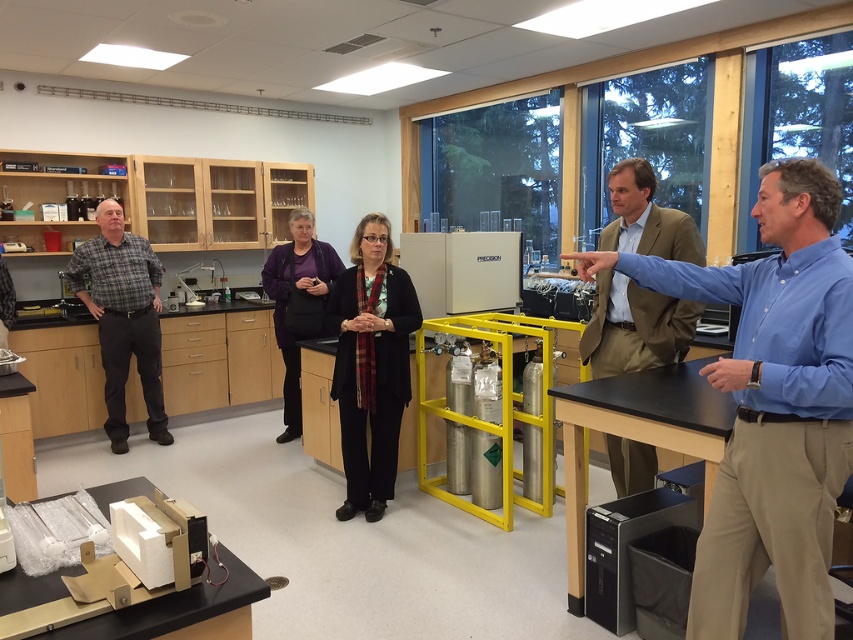
You are a person standing at point (769, 236). You want to walk to the nearest exit, which is located at the opposite side of the room. However, there are obstacles in your path. Can you reach the exit without moving more than 1.7 meters from your current position?

The distance between you and the exit is 1.78 meters, which is slightly more than the 1.7 meters limit. Therefore, you cannot reach the exit without exceeding the distance constraint.